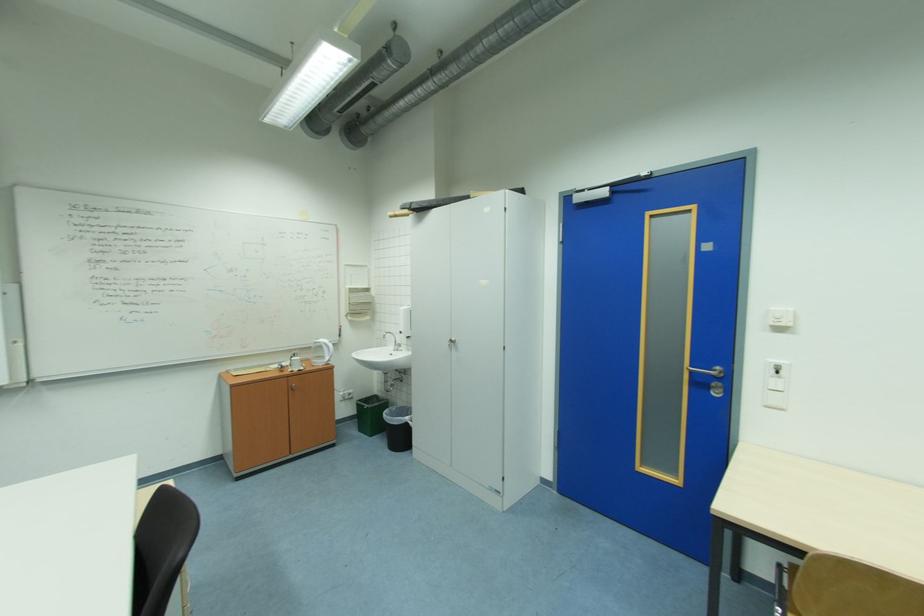
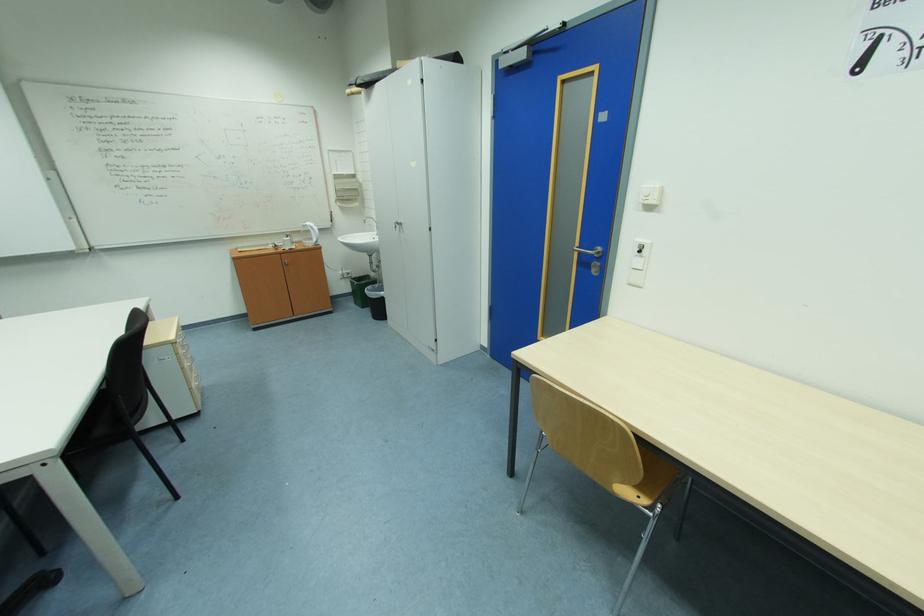
In the second image, find the point that corresponds to [326,342] in the first image.

(313, 225)